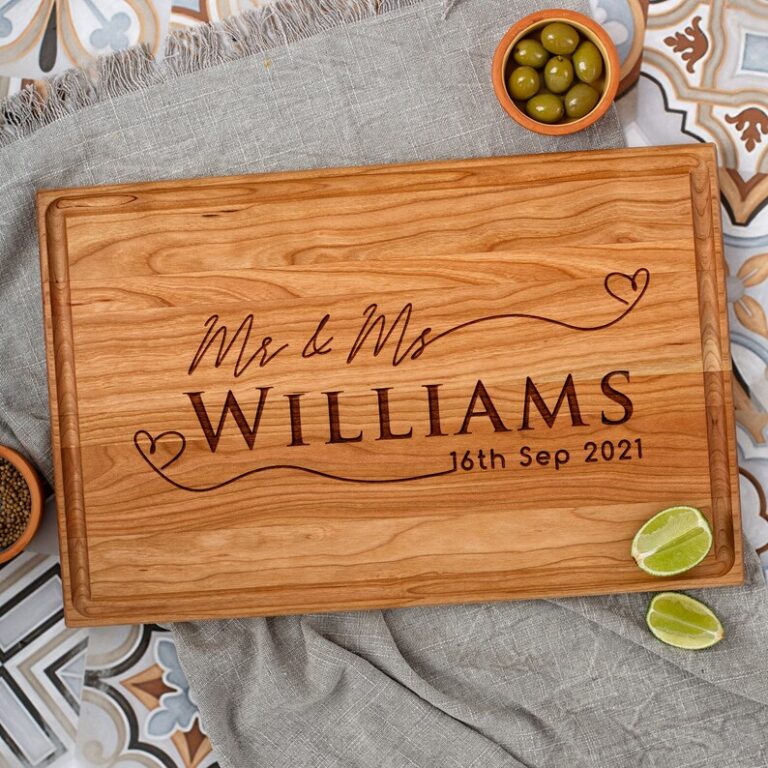
Where is `wooden tray/cutting board`? This screenshot has height=768, width=768. wooden tray/cutting board is located at coordinates (409, 257).